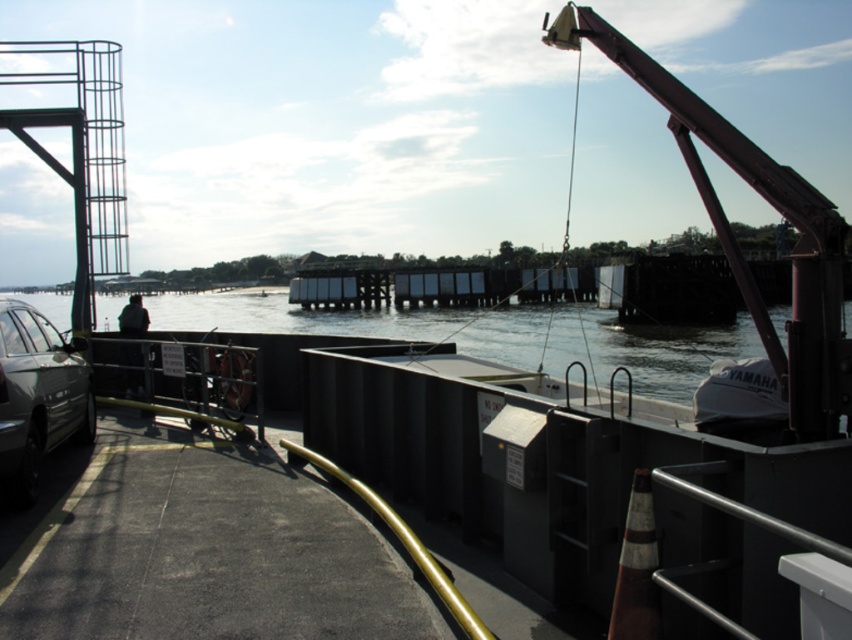
Question: Does clear water at center appear over shiny silver car at lower left?

Choices:
 (A) no
 (B) yes

Answer: (B)

Question: Is clear water at center to the right of shiny silver car at lower left from the viewer's perspective?

Choices:
 (A) no
 (B) yes

Answer: (A)

Question: Which point appears closest to the camera in this image?

Choices:
 (A) (392, 310)
 (B) (59, 349)

Answer: (B)

Question: Among these objects, which one is farthest from the camera?

Choices:
 (A) clear water at center
 (B) shiny silver car at lower left

Answer: (B)

Question: Among these points, which one is nearest to the camera?

Choices:
 (A) (42, 378)
 (B) (242, 298)

Answer: (A)

Question: Observing the image, what is the correct spatial positioning of clear water at center in reference to shiny silver car at lower left?

Choices:
 (A) left
 (B) right

Answer: (A)